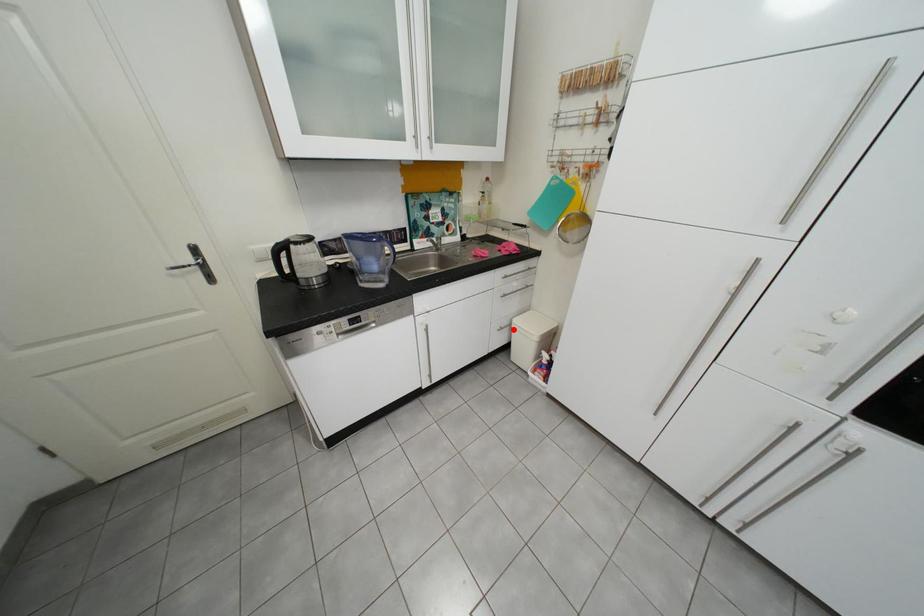
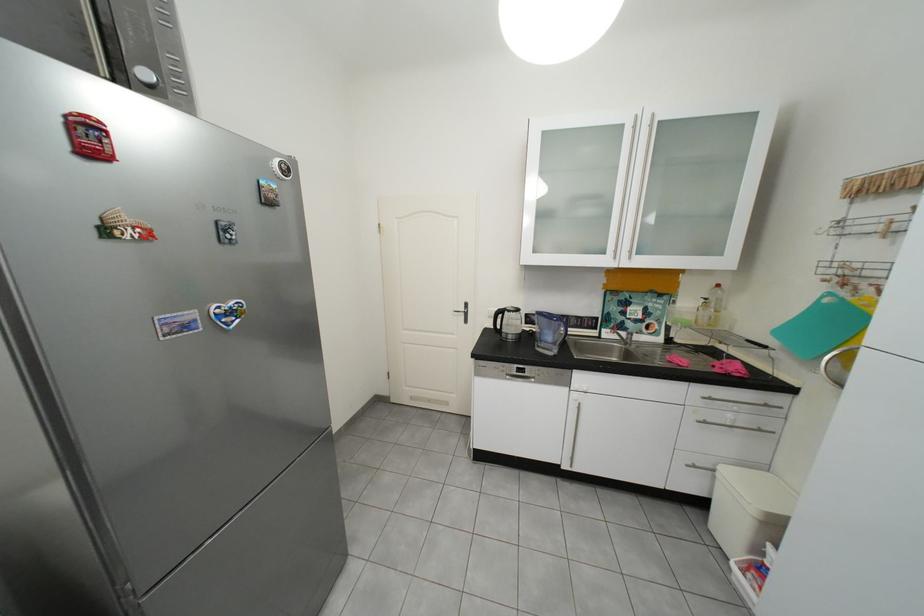
Find the pixel in the second image that matches the highlighted location in the first image.

(707, 468)